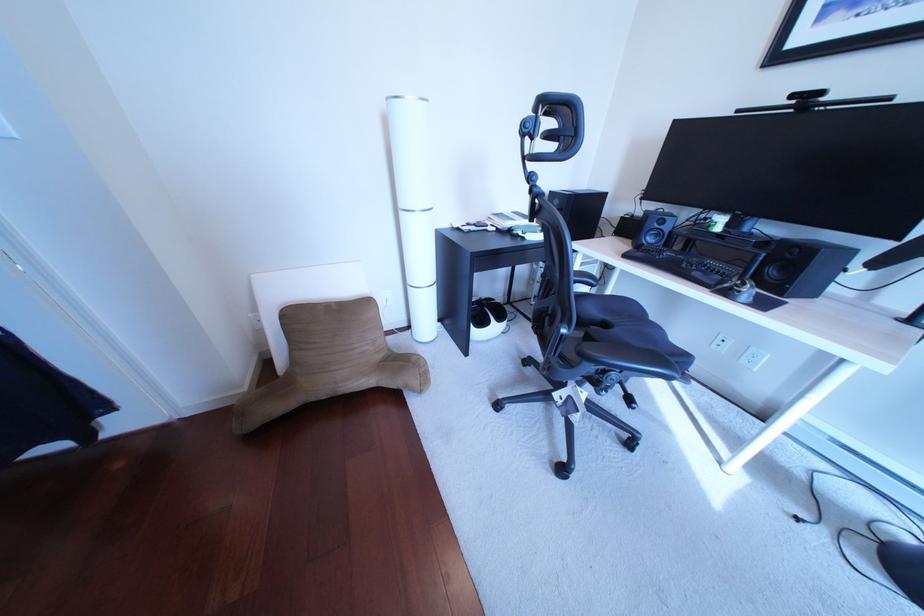
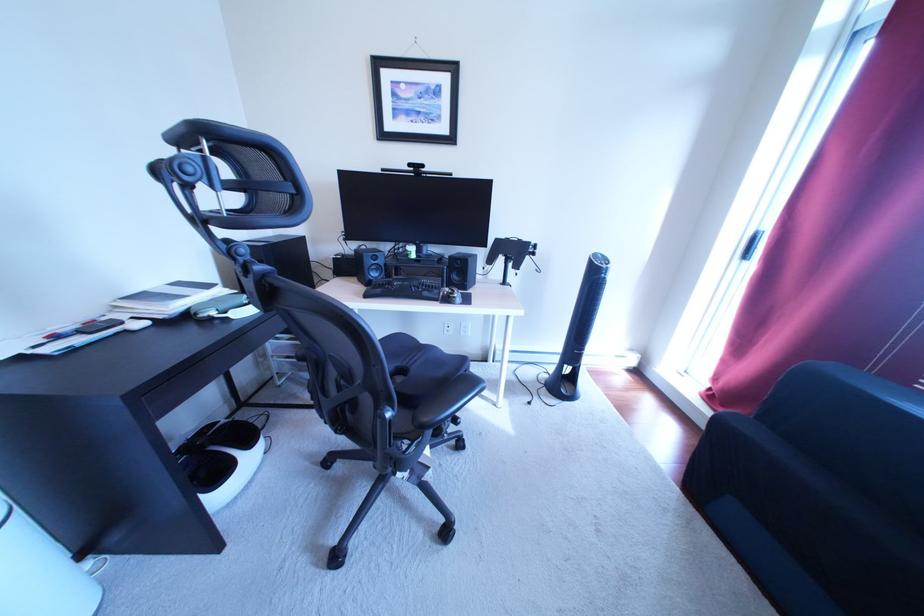
Question: The first image is from the beginning of the video and the second image is from the end. How did the camera likely rotate when shooting the video?

Choices:
 (A) Left
 (B) Right
 (C) Up
 (D) Down

Answer: (B)